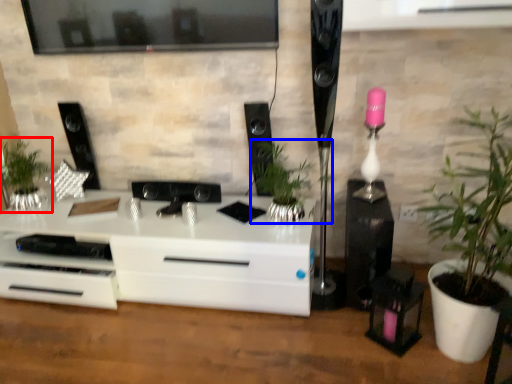
Question: Which of the following is the farthest to the observer, houseplant (highlighted by a red box) or houseplant (highlighted by a blue box)?

Choices:
 (A) houseplant
 (B) houseplant

Answer: (A)